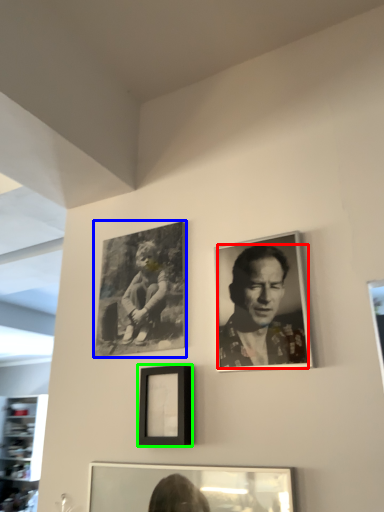
Question: Estimate the real-world distances between objects in this image. Which object is farther from man (highlighted by a red box), picture frame (highlighted by a blue box) or picture frame (highlighted by a green box)?

Choices:
 (A) picture frame
 (B) picture frame

Answer: (A)